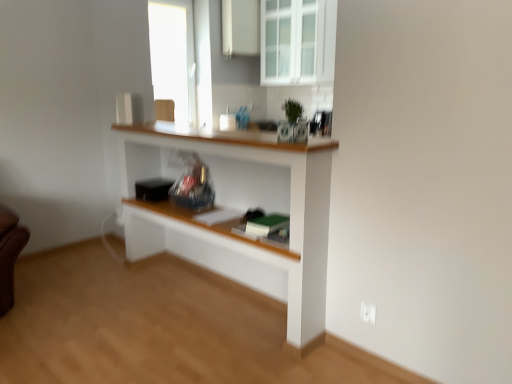
Question: Are white plastic electric outlet at lower right and white glass cabinet at upper center beside each other?

Choices:
 (A) yes
 (B) no

Answer: (B)

Question: Can you confirm if white plastic electric outlet at lower right is positioned to the right of white glass cabinet at upper center?

Choices:
 (A) yes
 (B) no

Answer: (A)

Question: From a real-world perspective, is white plastic electric outlet at lower right on white glass cabinet at upper center?

Choices:
 (A) yes
 (B) no

Answer: (B)

Question: From a real-world perspective, is white plastic electric outlet at lower right beneath white glass cabinet at upper center?

Choices:
 (A) no
 (B) yes

Answer: (B)

Question: Is white plastic electric outlet at lower right smaller than white glass cabinet at upper center?

Choices:
 (A) yes
 (B) no

Answer: (A)

Question: Considering the relative positions of white plastic electric outlet at lower right and white glass cabinet at upper center in the image provided, is white plastic electric outlet at lower right to the left of white glass cabinet at upper center from the viewer's perspective?

Choices:
 (A) yes
 (B) no

Answer: (B)

Question: Can you confirm if white glass cabinet at upper center is bigger than white wood shelf at center?

Choices:
 (A) yes
 (B) no

Answer: (B)

Question: Is there a large distance between white glass cabinet at upper center and white wood shelf at center?

Choices:
 (A) no
 (B) yes

Answer: (B)

Question: From a real-world perspective, is white glass cabinet at upper center below white wood shelf at center?

Choices:
 (A) no
 (B) yes

Answer: (A)

Question: Is white glass cabinet at upper center positioned beyond the bounds of white wood shelf at center?

Choices:
 (A) yes
 (B) no

Answer: (A)

Question: From the image's perspective, is white glass cabinet at upper center on top of white wood shelf at center?

Choices:
 (A) no
 (B) yes

Answer: (B)

Question: Does white glass cabinet at upper center appear on the right side of white wood shelf at center?

Choices:
 (A) yes
 (B) no

Answer: (A)

Question: Is the depth of white glossy cabinet at upper center greater than that of white glass cabinet at upper center?

Choices:
 (A) no
 (B) yes

Answer: (B)